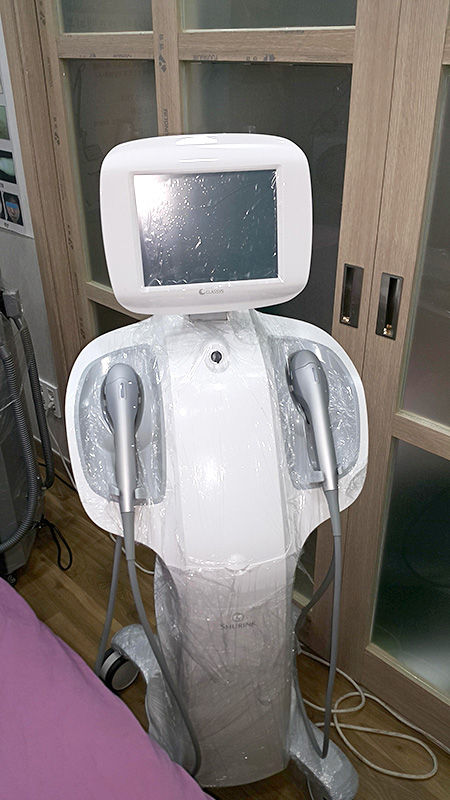
Locate an element on the screen. This screenshot has width=450, height=800. white cords is located at coordinates (408, 772), (357, 706), (145, 570), (47, 422).